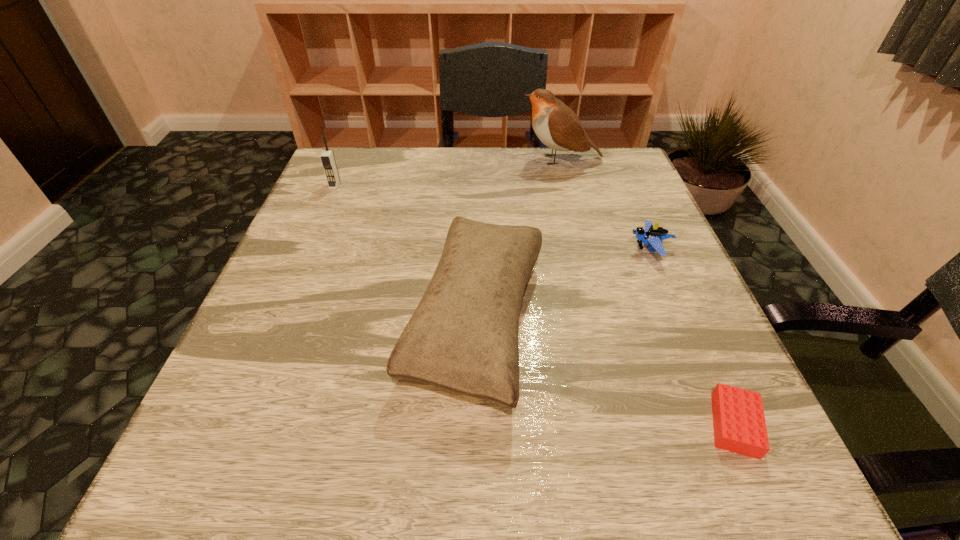
Where is `vacant area at the near left corner of the desktop`? vacant area at the near left corner of the desktop is located at coordinates (199, 504).

Locate an element on the screen. This screenshot has height=540, width=960. vacant space at the far right corner of the desktop is located at coordinates (590, 184).

What are the coordinates of `vacant space at the near right corner of the desktop` in the screenshot? It's located at (742, 492).

You are a GUI agent. You are given a task and a screenshot of the screen. Output one action in this format:
    pyautogui.click(x=<x>, y=<y>)
    Task: Click on the unoccupied position between the farthest object and the second tallest object
    
    Given the screenshot: What is the action you would take?
    pyautogui.click(x=448, y=173)

This screenshot has width=960, height=540. In order to click on free area in between the farthest object and the cellular telephone in this screenshot , I will do `click(448, 173)`.

The width and height of the screenshot is (960, 540). Find the location of `empty space between the fourth nearest object and the cushion`. empty space between the fourth nearest object and the cushion is located at coordinates (405, 253).

Identify the location of free space between the cushion and the fourth shortest object. pos(405,253).

Identify the location of unoccupied position between the second farthest object and the taller Lego. (492, 218).

Where is `free space between the farthest object and the taller Lego`? The width and height of the screenshot is (960, 540). free space between the farthest object and the taller Lego is located at coordinates (606, 204).

Where is `empty space that is in between the third tallest object and the taller Lego`? empty space that is in between the third tallest object and the taller Lego is located at coordinates (564, 285).